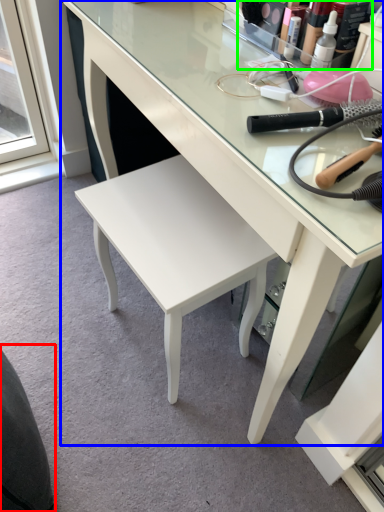
Question: Estimate the real-world distances between objects in this image. Which object is farther from swivel chair (highlighted by a red box), desk (highlighted by a blue box) or toiletry (highlighted by a green box)?

Choices:
 (A) desk
 (B) toiletry

Answer: (B)